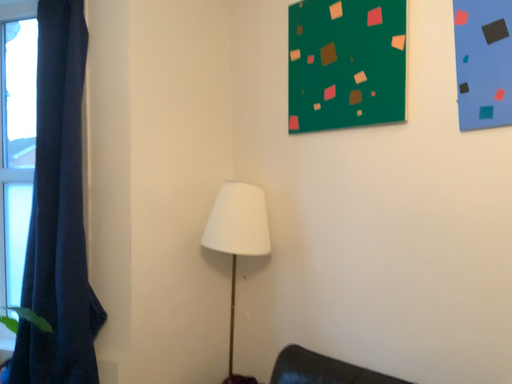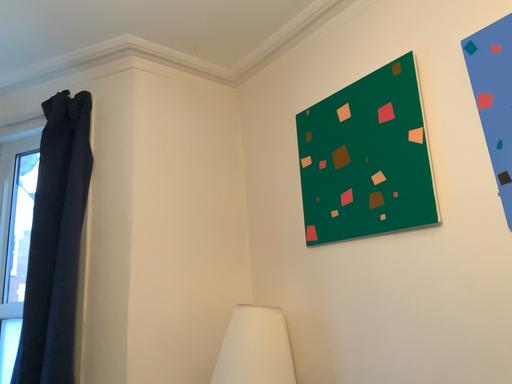
Question: How did the camera likely rotate when shooting the video?

Choices:
 (A) rotated downward
 (B) rotated upward

Answer: (B)